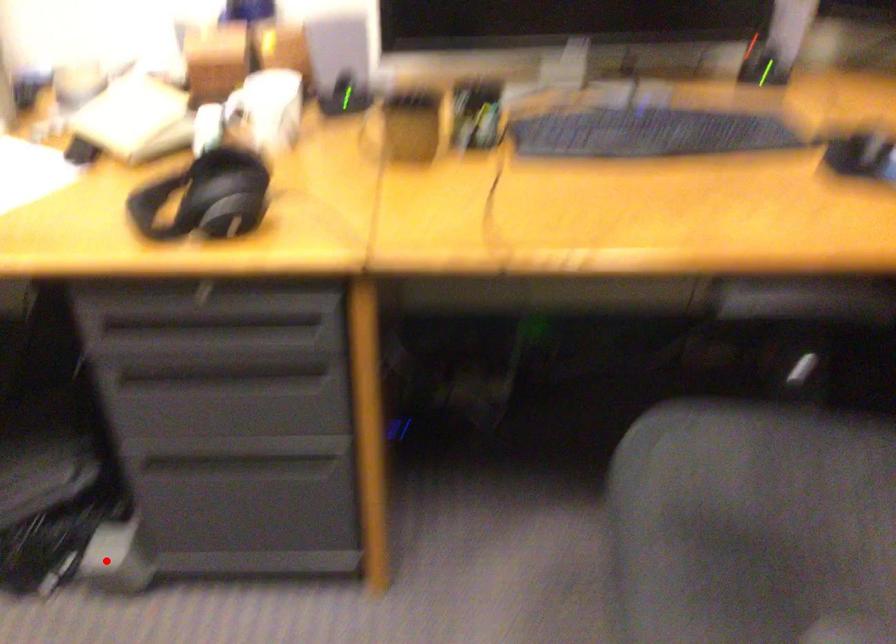
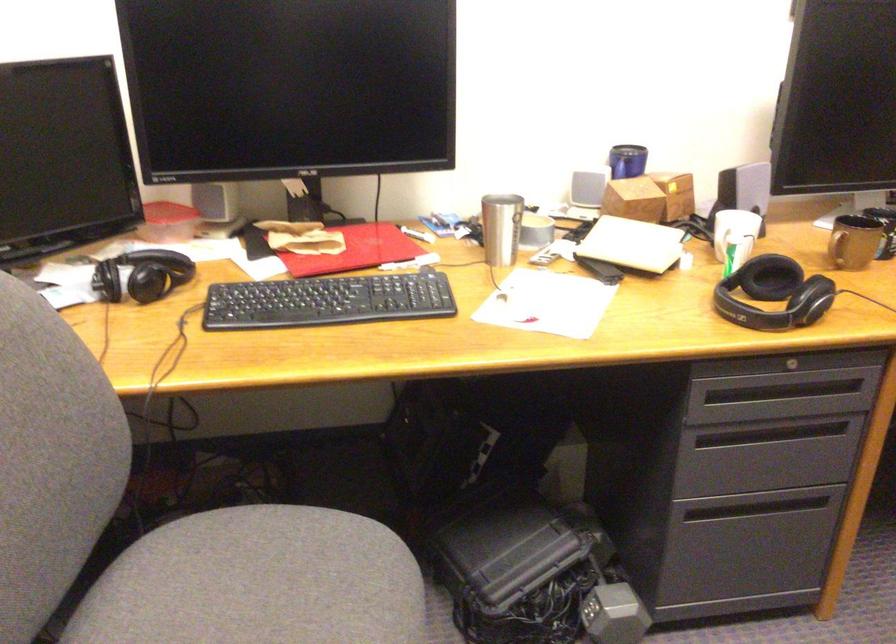
Question: I am providing you with two images of the same scene from different viewpoints. Given a red point in image1, look at the same physical point in image2. Is it:

Choices:
 (A) Closer to the viewpoint
 (B) Farther from the viewpoint

Answer: (B)